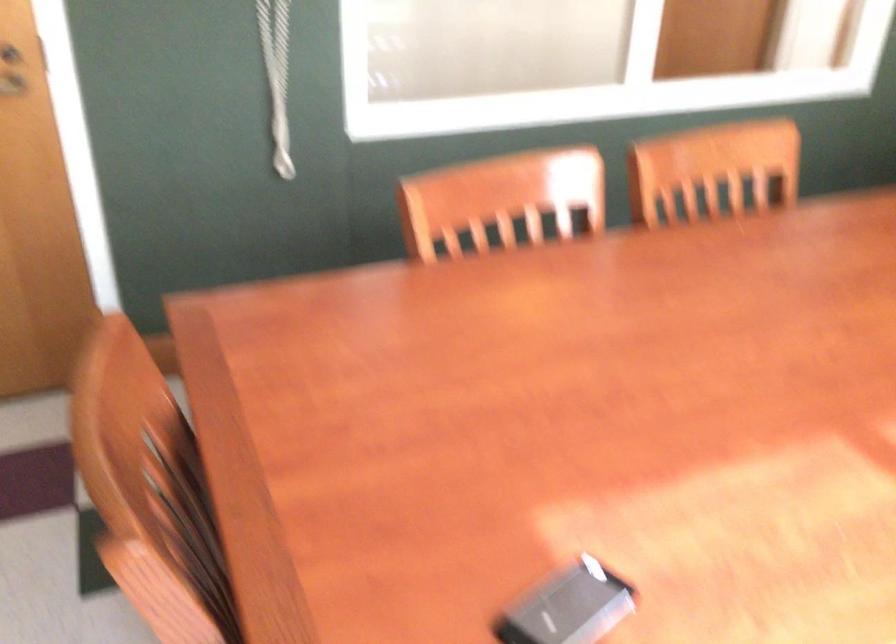
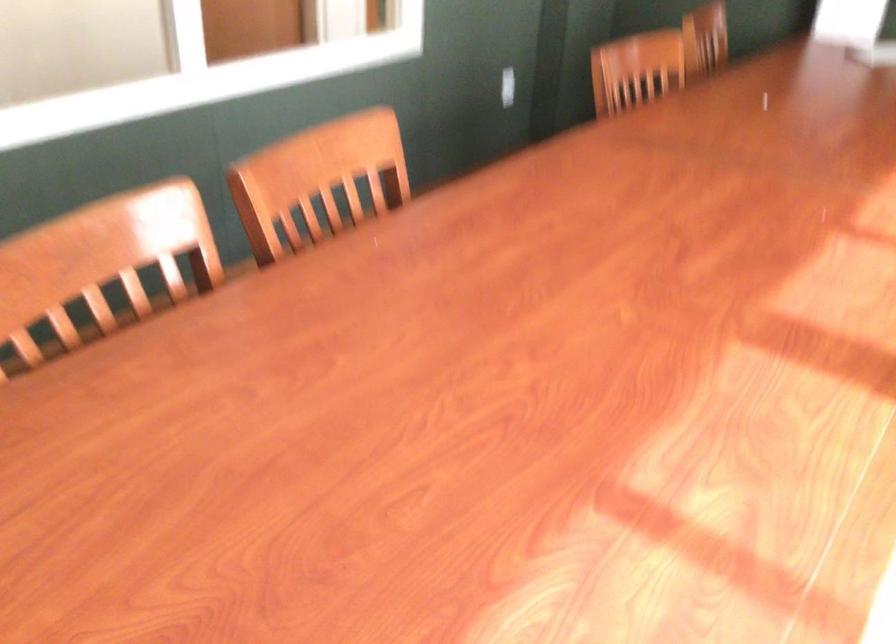
Question: The images are taken continuously from a first-person perspective. In which direction is your viewpoint rotating?

Choices:
 (A) Left
 (B) Right
 (C) Up
 (D) Down

Answer: (B)